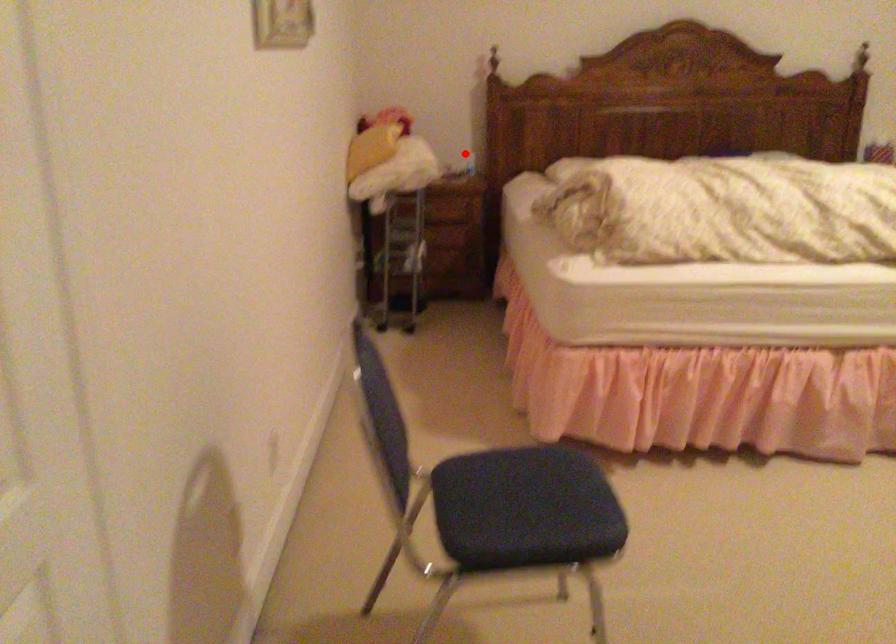
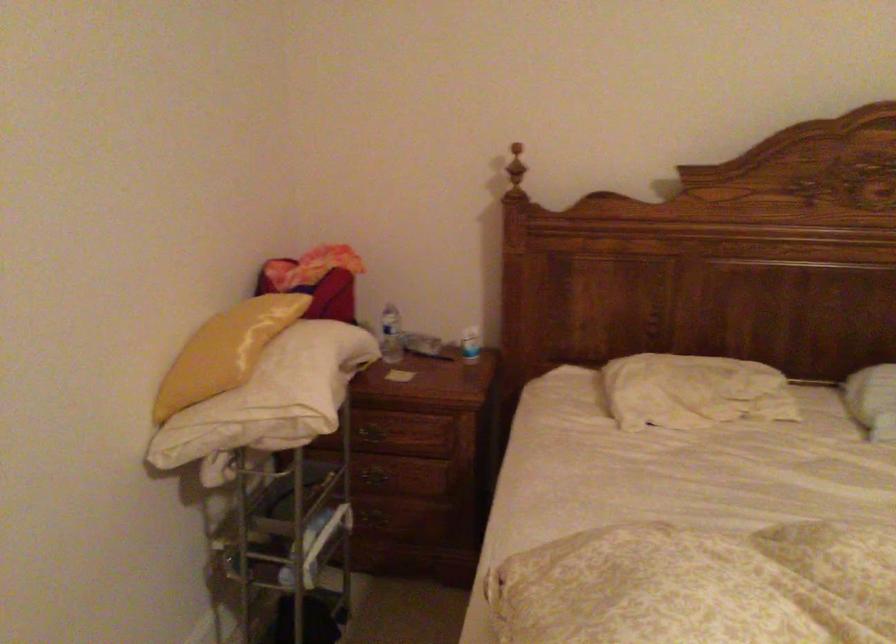
In the second image, find the point that corresponds to the highlighted location in the first image.

(470, 344)